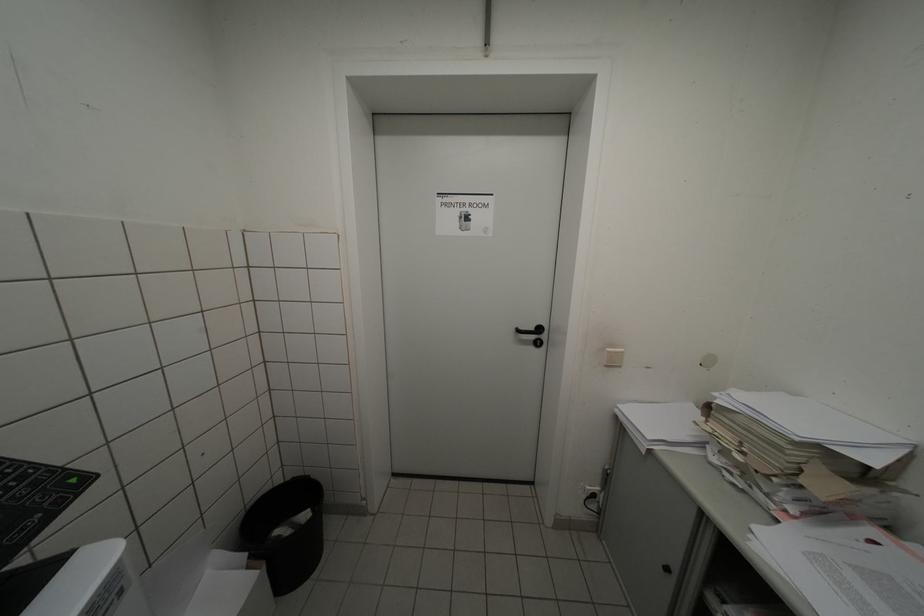
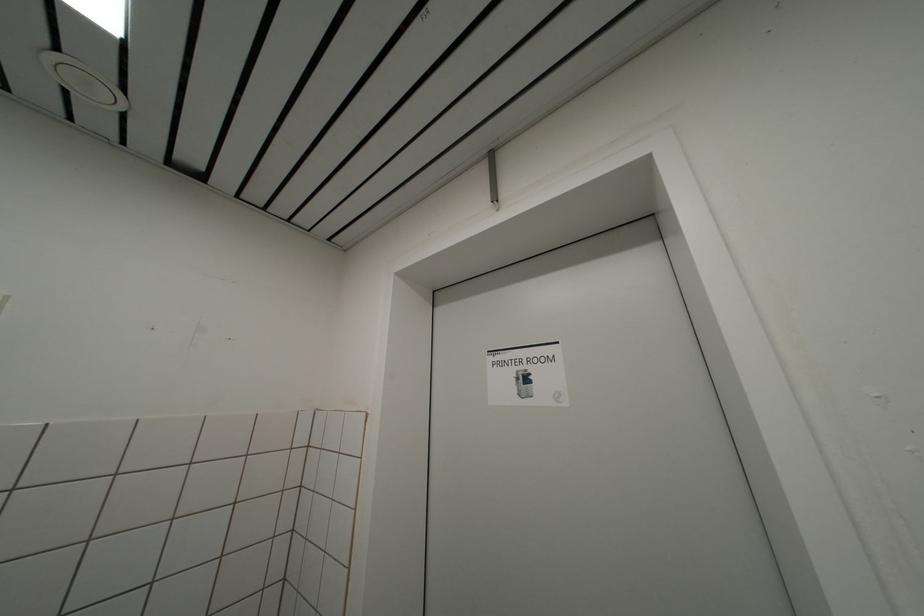
Based on the continuous images, in which direction is the camera rotating?

The camera rotated toward left-up.